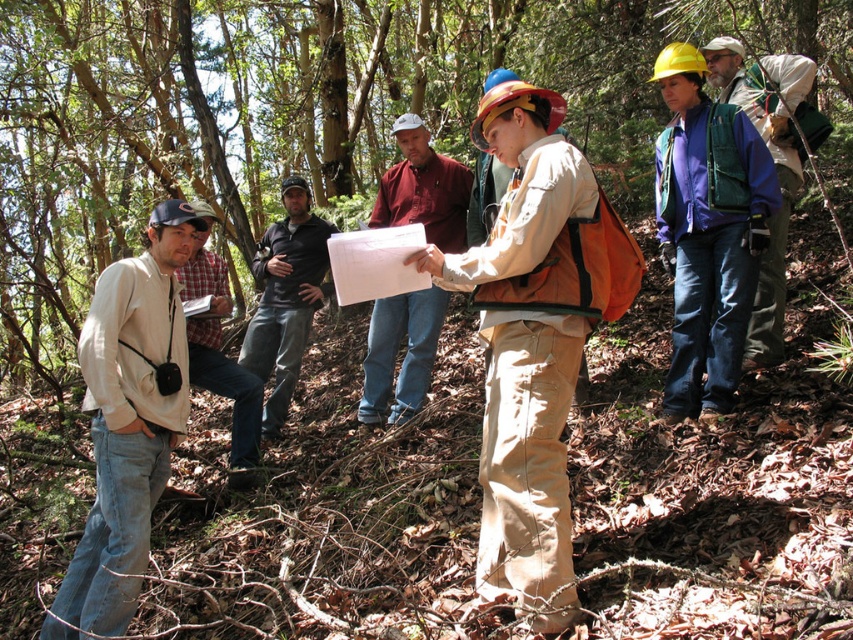
You are a photographer trying to capture a clear photo of the khaki cotton pants at center and the maroon cotton shirt at center. Which one will appear taller in the photo?

The khaki cotton pants at center will appear taller in the photo because it has a greater height compared to the maroon cotton shirt at center.

You are navigating through the wooded area and need to locate the khaki cotton pants at center. According to the coordinates provided, where exactly should you look to find them?

The khaki cotton pants at center is located at point coordinates of (527, 461).

In the wooded area scene, there are several people dressed for outdoor work. The black cotton shirt at center is represented by point (285, 298). Where is this point located relative to the other people in the group?

The black cotton shirt at center is represented by point (285, 298), which is at the center of the image.